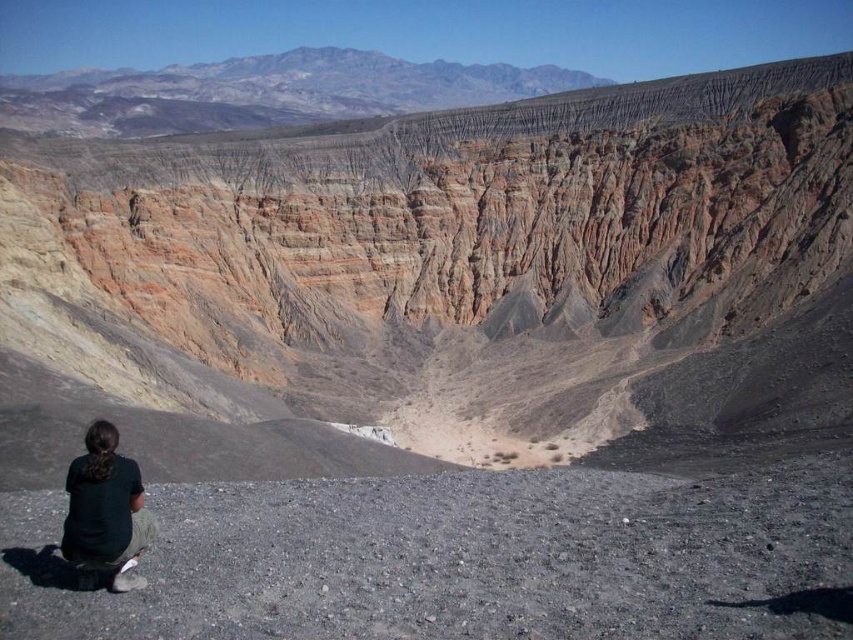
Does rustic rock formation at center lie in front of dark green shirt at lower left?

No.

Does rustic rock formation at center have a greater height compared to dark green shirt at lower left?

Indeed, rustic rock formation at center has a greater height compared to dark green shirt at lower left.

The image size is (853, 640). What do you see at coordinates (434, 280) in the screenshot? I see `rustic rock formation at center` at bounding box center [434, 280].

Where is `rustic rock formation at center`? The height and width of the screenshot is (640, 853). rustic rock formation at center is located at coordinates (434, 280).

Is rustic rock formation at center below rugged rock mountain at upper center?

Correct, rustic rock formation at center is located below rugged rock mountain at upper center.

Which of these two, rustic rock formation at center or rugged rock mountain at upper center, stands shorter?

Standing shorter between the two is rustic rock formation at center.

Identify the location of rustic rock formation at center. (434, 280).

Which is more to the right, rugged rock mountain at upper center or dark green shirt at lower left?

dark green shirt at lower left

Which is more to the left, rugged rock mountain at upper center or dark green shirt at lower left?

rugged rock mountain at upper center is more to the left.

What are the coordinates of `rugged rock mountain at upper center` in the screenshot? It's located at [263, 92].